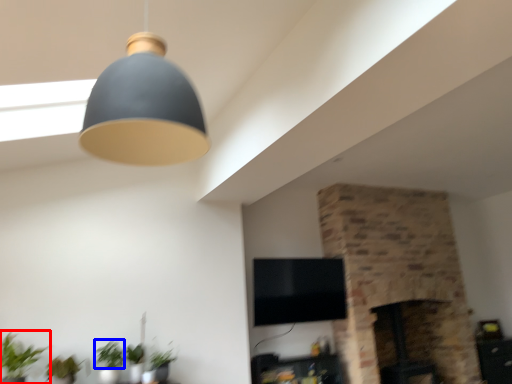
Question: Which of the following is the closest to the observer, houseplant (highlighted by a red box) or plant (highlighted by a blue box)?

Choices:
 (A) houseplant
 (B) plant

Answer: (A)